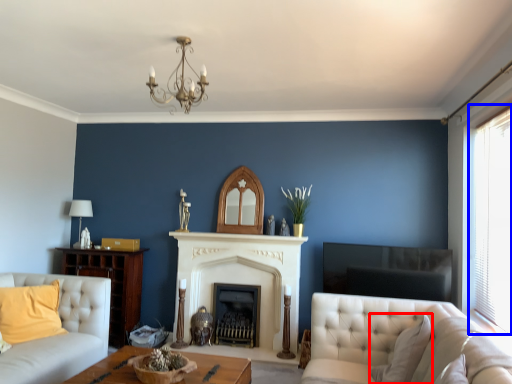
Question: Among these objects, which one is nearest to the camera, pillow (highlighted by a red box) or window (highlighted by a blue box)?

Choices:
 (A) pillow
 (B) window

Answer: (A)